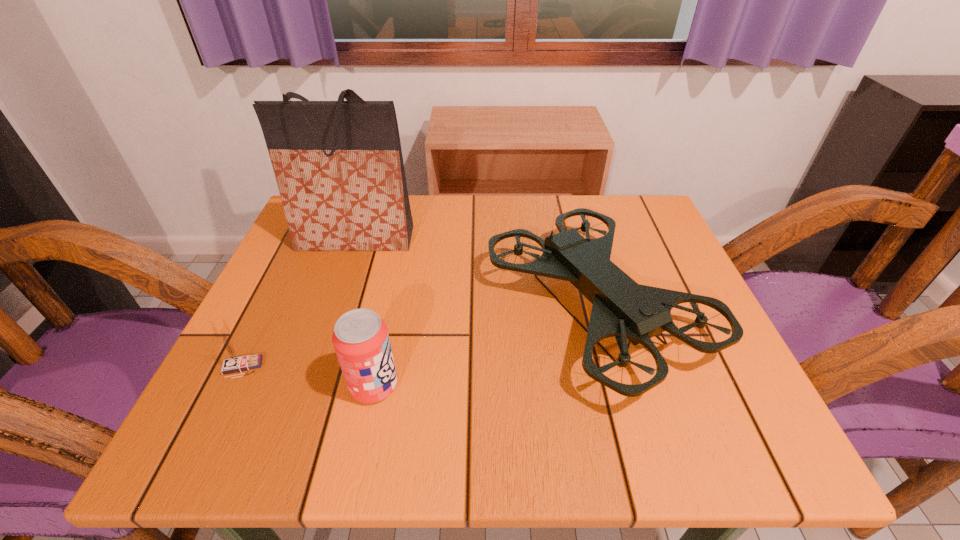
Locate an element on the screen. shopping bag is located at coordinates (339, 168).

You are a GUI agent. You are given a task and a screenshot of the screen. Output one action in this format:
    pyautogui.click(x=<x>, y=<y>)
    Task: Click on the rightmost object
    
    Given the screenshot: What is the action you would take?
    pyautogui.click(x=622, y=308)

Locate an element on the screen. Image resolution: width=960 pixels, height=540 pixels. the third shortest object is located at coordinates (622, 308).

Find the location of a particular element. This screenshot has width=960, height=540. the third tallest object is located at coordinates (361, 341).

Identify the location of matchbox. The width and height of the screenshot is (960, 540). (234, 362).

Image resolution: width=960 pixels, height=540 pixels. What are the coordinates of `free point located on the front-facing side of the tallest object` in the screenshot? It's located at (317, 350).

Identify the location of vacant space positioned on the left of the rightmost object. The height and width of the screenshot is (540, 960). (414, 308).

Locate an element on the screen. The width and height of the screenshot is (960, 540). vacant area located on the surface of the third tallest object is located at coordinates (568, 386).

Image resolution: width=960 pixels, height=540 pixels. Identify the location of vacant position located 0.290m on the back of the matchbox. (297, 255).

Identify the location of shopping bag that is positioned at the far edge. (339, 168).